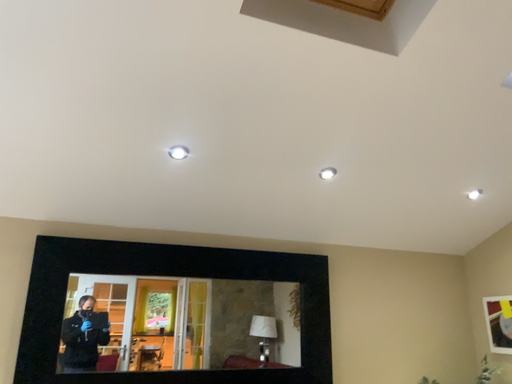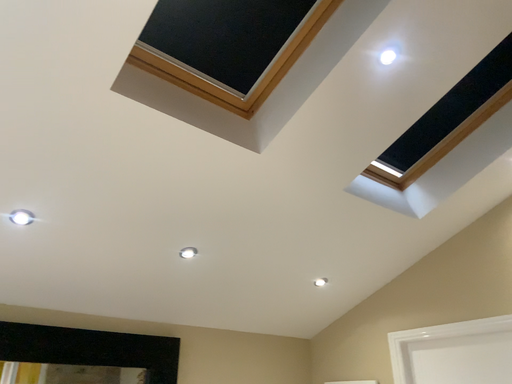
Question: Which way did the camera rotate in the video?

Choices:
 (A) rotated left
 (B) rotated right

Answer: (B)